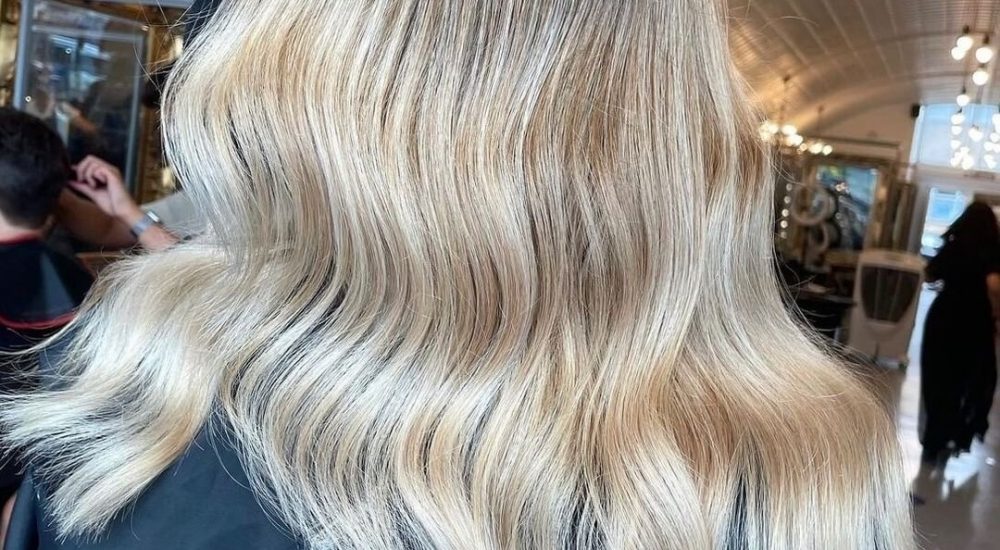
Image resolution: width=1000 pixels, height=550 pixels. In order to click on lightbulb in this screenshot , I will do `click(957, 52)`.